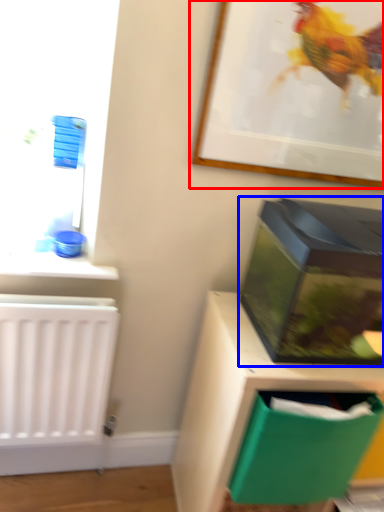
Question: Which of the following is the farthest to the observer, picture frame (highlighted by a red box) or box (highlighted by a blue box)?

Choices:
 (A) picture frame
 (B) box

Answer: (A)